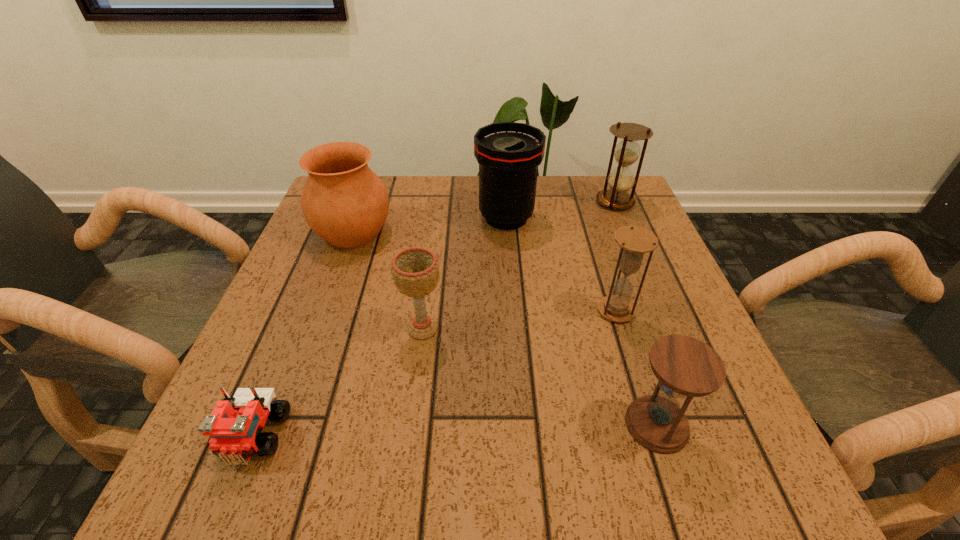
Identify the location of free space located 0.260m on the back of the second farthest hourglass. The width and height of the screenshot is (960, 540). (588, 225).

I want to click on vacant area located on the front of the chalice, so click(x=408, y=443).

Locate an element on the screen. Image resolution: width=960 pixels, height=540 pixels. vacant space situated on the front of the nearest hourglass is located at coordinates (680, 496).

The width and height of the screenshot is (960, 540). Identify the location of telephoto lens located in the far edge section of the desktop. (509, 153).

You are a GUI agent. You are given a task and a screenshot of the screen. Output one action in this format:
    pyautogui.click(x=<x>, y=<y>)
    Task: Click on the hourglass that is at the far edge
    
    Given the screenshot: What is the action you would take?
    pyautogui.click(x=621, y=179)

The height and width of the screenshot is (540, 960). I want to click on pottery situated at the far edge, so click(x=343, y=201).

Image resolution: width=960 pixels, height=540 pixels. I want to click on hourglass present at the near edge, so click(686, 367).

Locate an element on the screen. The image size is (960, 540). Lego present at the near edge is located at coordinates (x=235, y=426).

Find the location of `pottery situated at the left edge`. pottery situated at the left edge is located at coordinates (343, 201).

Locate an element on the screen. The image size is (960, 540). Lego that is positioned at the left edge is located at coordinates pyautogui.click(x=235, y=426).